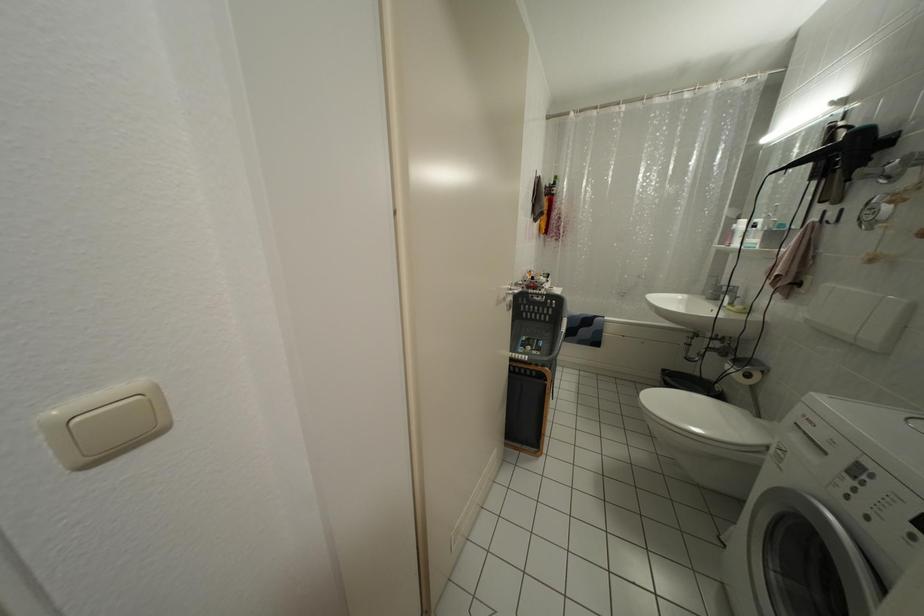
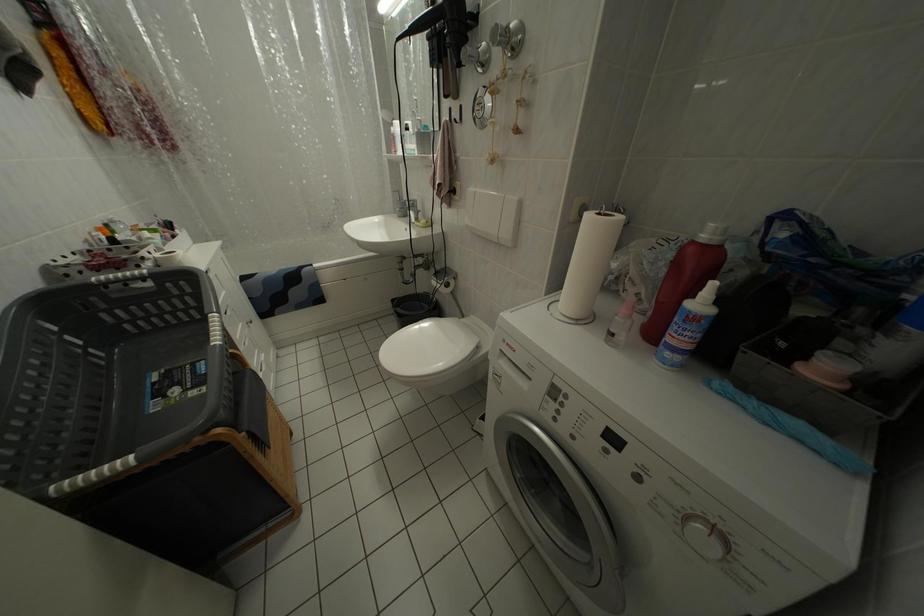
In the scene shown: The first image is from the beginning of the video and the second image is from the end. How did the camera likely rotate when shooting the video?

The rotation direction of the camera is right-down.